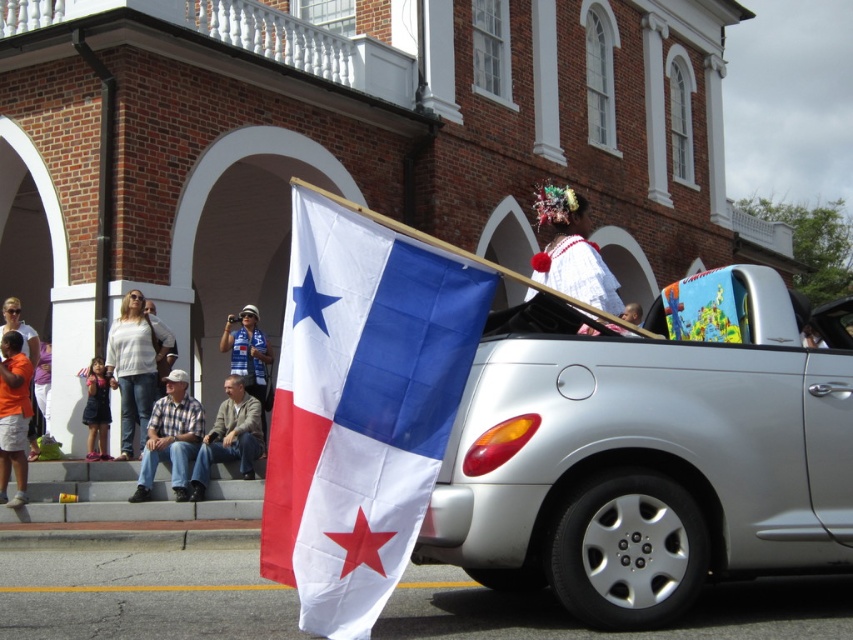
Question: Which point is closer to the camera?

Choices:
 (A) white fabric headdress at upper center
 (B) dark blue dress at lower left

Answer: (A)

Question: Which object is positioned closest to the white cotton shirt at left?

Choices:
 (A) white fabric headdress at upper center
 (B) plaid shirt at lower left
 (C) white fabric flag at center
 (D) orange cotton shirt at lower left

Answer: (B)

Question: Which of the following is the closest to the observer?

Choices:
 (A) dark blue dress at lower left
 (B) white fabric headdress at upper center
 (C) light brown leather jacket at lower center
 (D) plaid shirt at lower left

Answer: (B)

Question: Does silver metallic car at center have a greater width compared to plaid shirt at lower left?

Choices:
 (A) no
 (B) yes

Answer: (B)

Question: Is white cotton shirt at left to the right of plaid shirt at lower left from the viewer's perspective?

Choices:
 (A) yes
 (B) no

Answer: (B)

Question: Does light brown leather jacket at lower center have a larger size compared to dark blue dress at lower left?

Choices:
 (A) no
 (B) yes

Answer: (B)